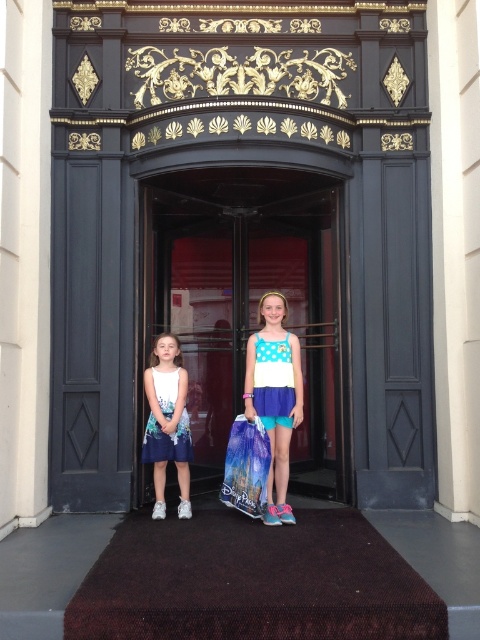
You are a photographer setting up a shoot in front of the ornate black door with gold detailing. You have two items to place in the scene for the photo shoot. You need to ensure that the transparent plastic bag at center and the polka dot dress at center are both visible in the frame. Which item should you position closer to the camera to ensure both are clearly visible?

The transparent plastic bag at center is larger in size than the polka dot dress at center. To ensure both are clearly visible, position the smaller polka dot dress at center closer to the camera so its details can be captured well, while the larger transparent plastic bag at center can be placed slightly farther back but still within the frame.

You are a photographer trying to capture both the transparent plastic bag at center and the white polka dot dress at center in a single frame. Based on their sizes, which object should you focus on to ensure both fit in the photo?

The transparent plastic bag at center might be wider than the white polka dot dress at center, so focusing on the transparent plastic bag at center would ensure both fit in the photo.